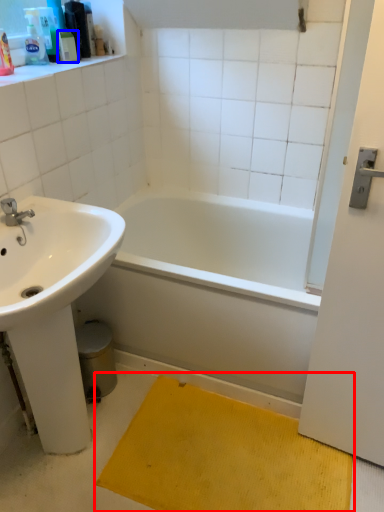
Question: Which object is closer to the camera taking this photo, doormat (highlighted by a red box) or toiletry (highlighted by a blue box)?

Choices:
 (A) doormat
 (B) toiletry

Answer: (A)